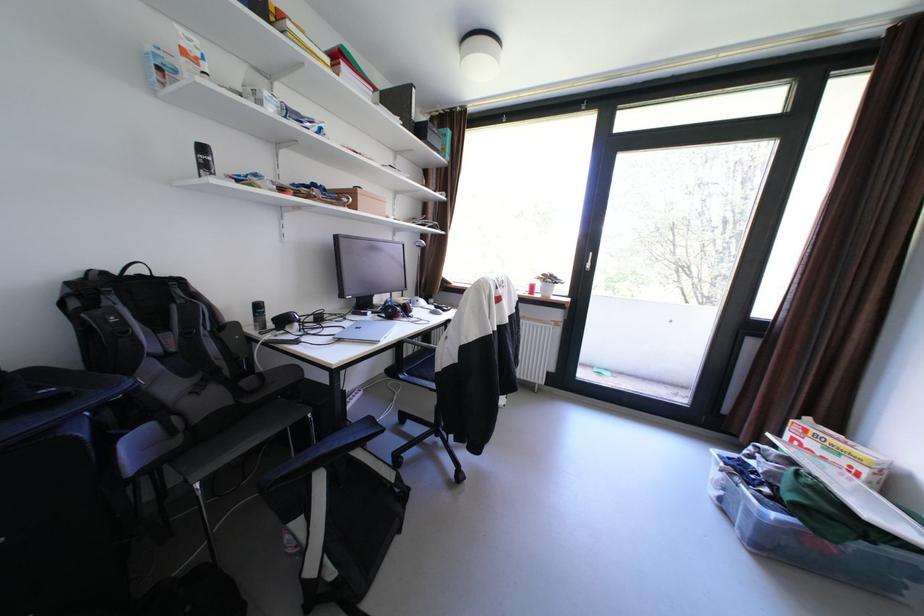
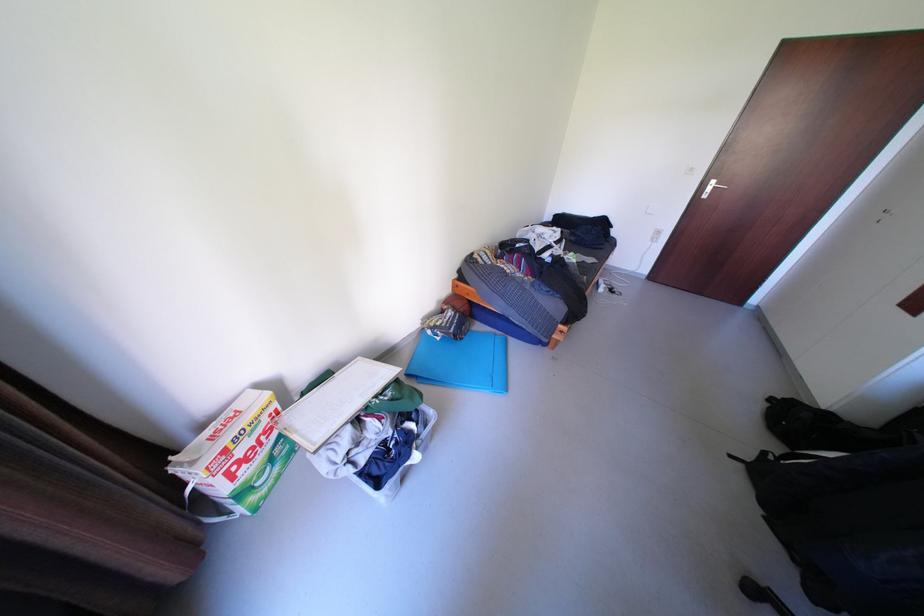
The point at [804,439] is marked in the first image. Where is the corresponding point in the second image?

(237, 474)